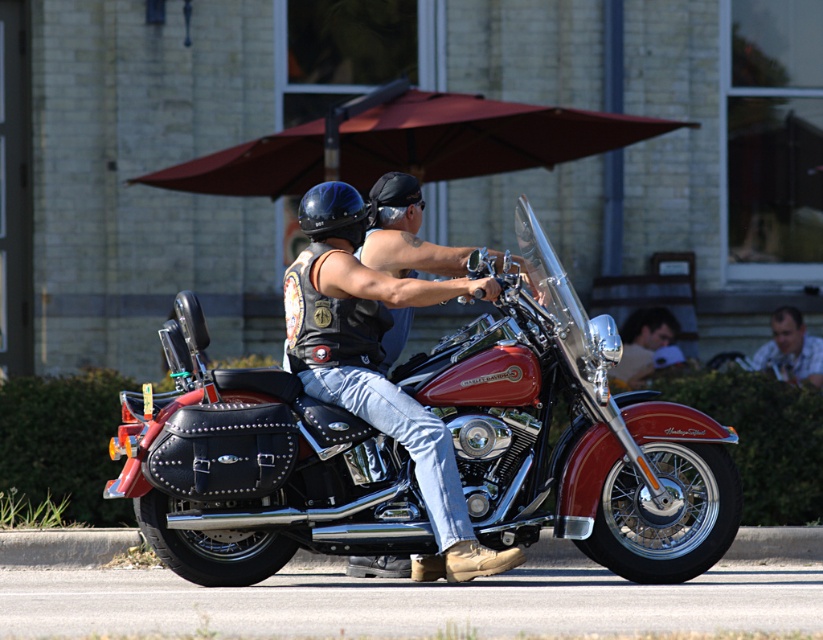
You are a photographer trying to capture the rider wearing the matte black vest at center and the blue matte helmet at upper center. Which object should you focus on first if you want to ensure both are in the frame?

The matte black vest at center is positioned under the blue matte helmet at upper center, so you should focus on the blue matte helmet at upper center first to ensure both are in the frame.

You are a photographer who needs to capture a clear shot of both the blue matte helmet at upper center and the black matte helmet at center. Which helmet is located lower in the image?

The black matte helmet at center is lower because the blue matte helmet at upper center is positioned under it.

You are a photographer trying to capture the rider and passenger on the motorcycle. You notice the matte black vest at center and the blue matte helmet at upper center. Which object should you focus on first if you want to photograph the taller one?

The matte black vest at center is taller than the blue matte helmet at upper center, so you should focus on the matte black vest at center first.